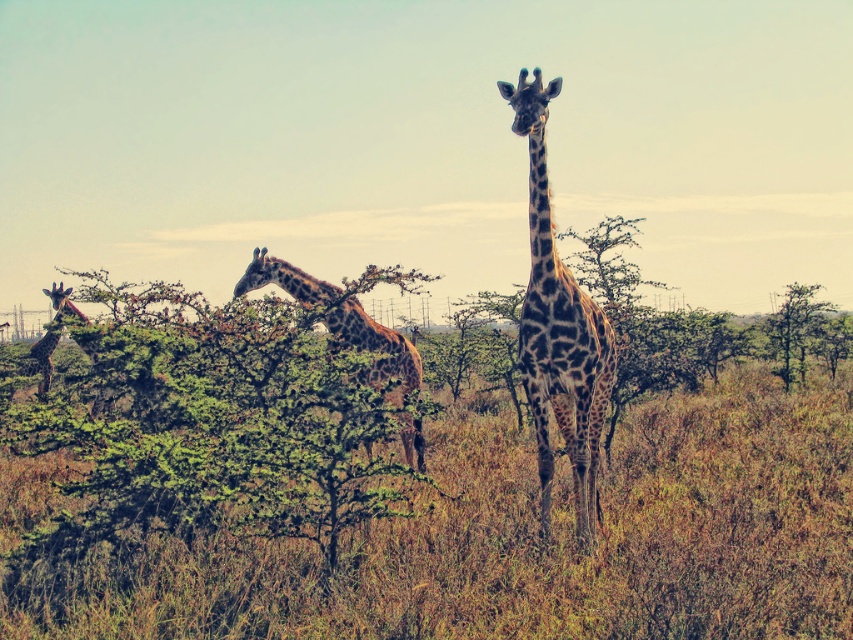
Is green leafy bush at center further to camera compared to spotted fur giraffe at left?

No, it is not.

Is point (47, 540) more distant than point (71, 305)?

That is False.

At what (x,y) coordinates should I click in order to perform the action: click on green leafy bush at center. Please return your answer as a coordinate pair (x, y). The width and height of the screenshot is (853, 640). Looking at the image, I should click on (218, 416).

Can you confirm if spotted brown giraffe at center is taller than green leafy tree at upper right?

Yes.

Between point (300, 278) and point (827, 358), which one is positioned in front?

Point (300, 278) is in front.

Between point (335, 333) and point (773, 321), which one is positioned behind?

Positioned behind is point (773, 321).

You are a GUI agent. You are given a task and a screenshot of the screen. Output one action in this format:
    pyautogui.click(x=<x>, y=<y>)
    Task: Click on the spotted brown giraffe at center
    This screenshot has height=640, width=853.
    Given the screenshot: What is the action you would take?
    pyautogui.click(x=341, y=321)

Is spotted fur giraffe at center positioned at the back of spotted brown giraffe at center?

Yes, spotted fur giraffe at center is further from the viewer.

Can you confirm if spotted fur giraffe at center is positioned below spotted brown giraffe at center?

Incorrect, spotted fur giraffe at center is not positioned below spotted brown giraffe at center.

Identify the location of spotted fur giraffe at center. The image size is (853, 640). (558, 326).